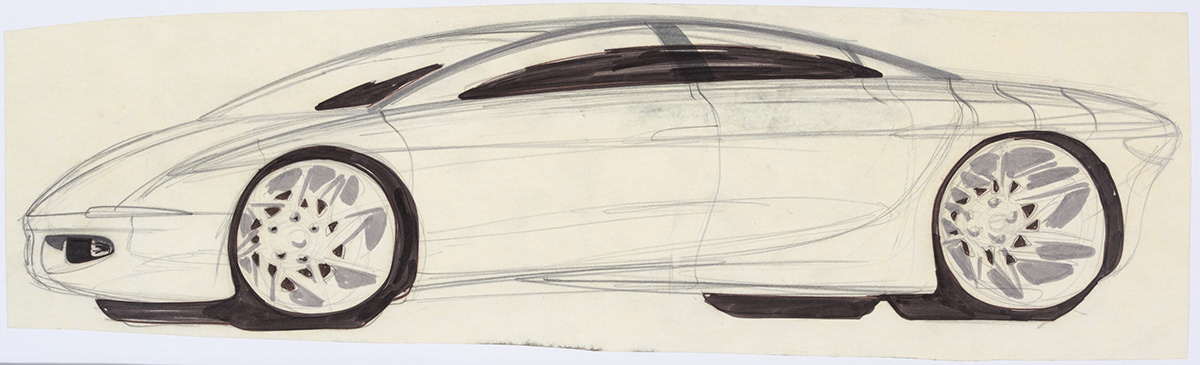
The width and height of the screenshot is (1200, 365). Find the location of `door`. door is located at coordinates (654, 174), (836, 179).